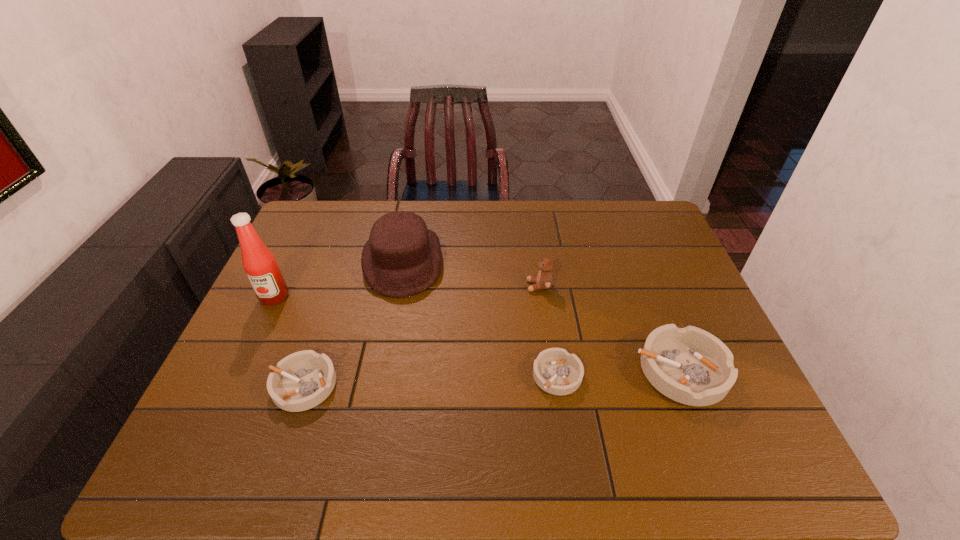
Please mark a free spot for a new ashtray to balance the arrangement. Please provide its 2D coordinates. Your answer should be formatted as a tuple, i.e. [(x, y)], where the tuple contains the x and y coordinates of a point satisfying the conditions above.

[(431, 380)]